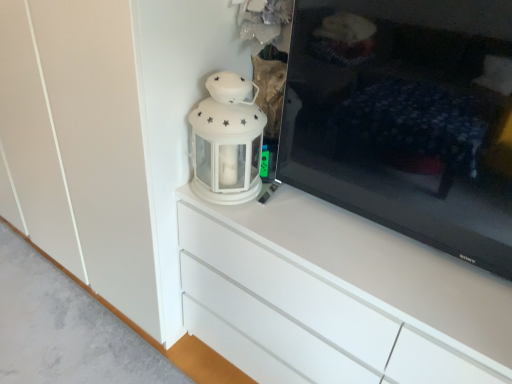
Where is `free space between black glossy tv at right and white glossy lantern at upper center`? The image size is (512, 384). free space between black glossy tv at right and white glossy lantern at upper center is located at coordinates (324, 230).